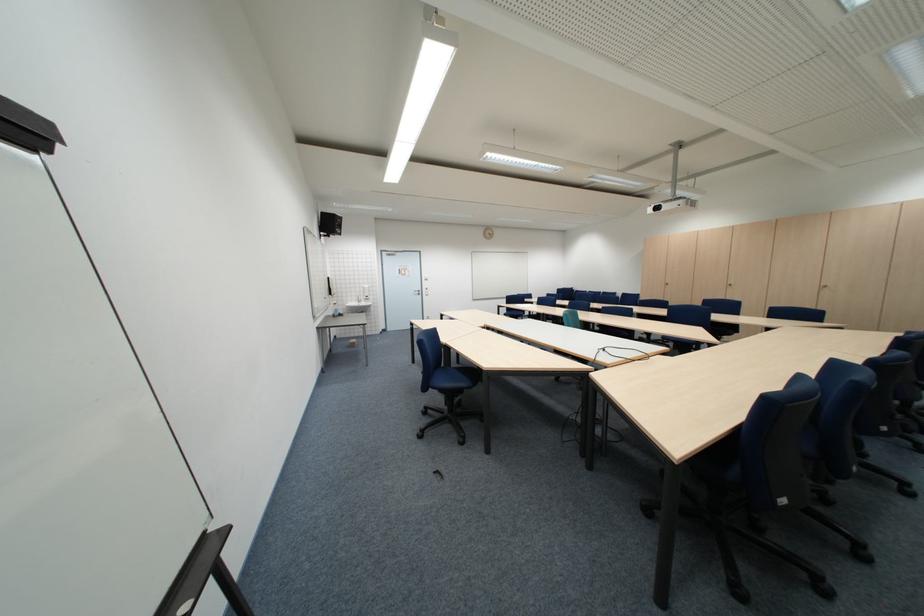
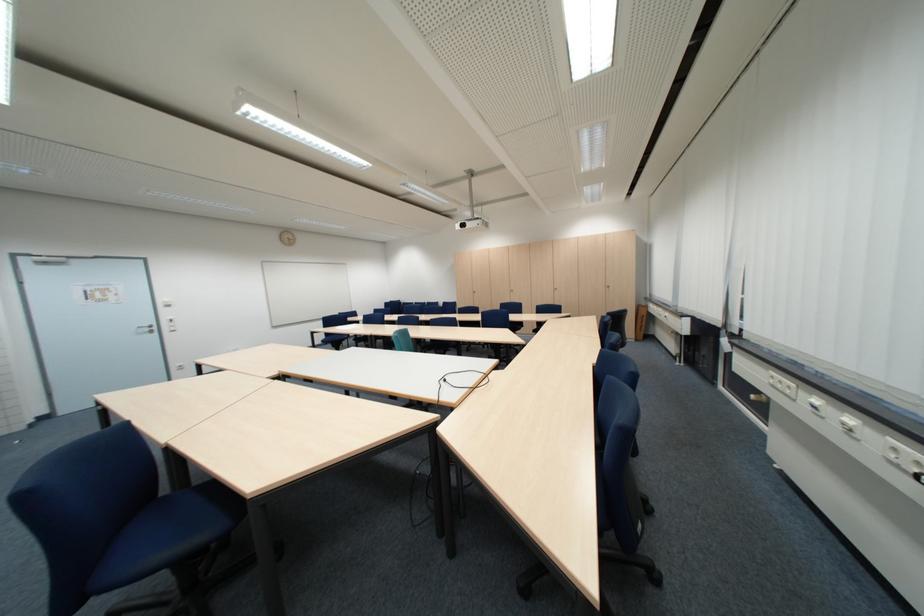
In the second image, find the point that corresponds to (456,367) in the first image.

(177, 492)